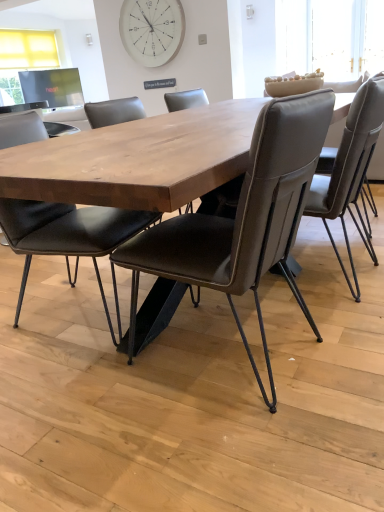
Measure the distance between brown leather chair at center, the 2th chair viewed from the left, and camera.

96.15 centimeters.

The width and height of the screenshot is (384, 512). What do you see at coordinates (152, 30) in the screenshot? I see `white wooden clock at upper center` at bounding box center [152, 30].

This screenshot has height=512, width=384. I want to click on leather-like chair at center, marked as the 1th chair in a right-to-left arrangement, so click(x=350, y=159).

Between matte black chair at center, which ranks as the 3th chair in right-to-left order, and brown leather chair at center, which is the second chair from right to left, which one appears on the left side from the viewer's perspective?

matte black chair at center, which ranks as the 3th chair in right-to-left order.

Is matte black chair at center, positioned as the 1th chair in left-to-right order, looking in the opposite direction of brown leather chair at center, which is the second chair from right to left?

That's not correct — matte black chair at center, positioned as the 1th chair in left-to-right order, is not looking away from brown leather chair at center, which is the second chair from right to left.

Is matte black chair at center, positioned as the 1th chair in left-to-right order, closer to the viewer compared to brown leather chair at center, the 2th chair viewed from the left?

No, the depth of matte black chair at center, positioned as the 1th chair in left-to-right order, is greater than that of brown leather chair at center, the 2th chair viewed from the left.

In terms of height, does matte black chair at center, positioned as the 1th chair in left-to-right order, look taller or shorter compared to brown leather chair at center, the 2th chair viewed from the left?

Considering their sizes, matte black chair at center, positioned as the 1th chair in left-to-right order, has more height than brown leather chair at center, the 2th chair viewed from the left.

Does point (306, 120) come behind point (170, 28)?

No.

From a real-world perspective, between brown leather chair at center, the 2th chair viewed from the left, and white wooden clock at upper center, who is vertically higher?

white wooden clock at upper center, from a real-world perspective.

Is brown leather chair at center, which is the second chair from right to left, not close to white wooden clock at upper center?

Yes.

Does brown leather chair at center, which is the second chair from right to left, appear on the right side of white wooden clock at upper center?

Correct, you'll find brown leather chair at center, which is the second chair from right to left, to the right of white wooden clock at upper center.

Considering the points (281, 241) and (374, 115), which point is in front, point (281, 241) or point (374, 115)?

The point (281, 241) is closer to the camera.

Is brown leather chair at center, the 2th chair viewed from the left, facing away from leather-like chair at center, marked as the 1th chair in a right-to-left arrangement?

No, leather-like chair at center, marked as the 1th chair in a right-to-left arrangement, is not at the back of brown leather chair at center, the 2th chair viewed from the left.

From the image's perspective, is brown leather chair at center, the 2th chair viewed from the left, below leather-like chair at center, marked as the 1th chair in a right-to-left arrangement?

Yes, from the image's perspective, brown leather chair at center, the 2th chair viewed from the left, is below leather-like chair at center, marked as the 1th chair in a right-to-left arrangement.

From a real-world perspective, is brown leather chair at center, which is the second chair from right to left, below leather-like chair at center, the third chair positioned from the left?

Yes, from a real-world perspective, brown leather chair at center, which is the second chair from right to left, is beneath leather-like chair at center, the third chair positioned from the left.

From a real-world perspective, which is physically below, white wooden clock at upper center or leather-like chair at center, the third chair positioned from the left?

leather-like chair at center, the third chair positioned from the left.

Which object is further away from the camera, white wooden clock at upper center or leather-like chair at center, marked as the 1th chair in a right-to-left arrangement?

white wooden clock at upper center.

Is white wooden clock at upper center positioned with its back to leather-like chair at center, the third chair positioned from the left?

No, leather-like chair at center, the third chair positioned from the left, is not at the back of white wooden clock at upper center.

Is white wooden clock at upper center wider than leather-like chair at center, marked as the 1th chair in a right-to-left arrangement?

In fact, white wooden clock at upper center might be narrower than leather-like chair at center, marked as the 1th chair in a right-to-left arrangement.

From the image's perspective, is leather-like chair at center, marked as the 1th chair in a right-to-left arrangement, positioned above or below white wooden clock at upper center?

Clearly, from the image's perspective, leather-like chair at center, marked as the 1th chair in a right-to-left arrangement, is below white wooden clock at upper center.

Would you consider leather-like chair at center, marked as the 1th chair in a right-to-left arrangement, to be distant from white wooden clock at upper center?

leather-like chair at center, marked as the 1th chair in a right-to-left arrangement, is far away from white wooden clock at upper center.

Visually, is leather-like chair at center, marked as the 1th chair in a right-to-left arrangement, positioned to the left or to the right of white wooden clock at upper center?

leather-like chair at center, marked as the 1th chair in a right-to-left arrangement, is positioned on white wooden clock at upper center's right side.

Looking at this image, does leather-like chair at center, marked as the 1th chair in a right-to-left arrangement, have a greater width compared to white wooden clock at upper center?

Yes, leather-like chair at center, marked as the 1th chair in a right-to-left arrangement, is wider than white wooden clock at upper center.

Would you say matte black chair at center, positioned as the 1th chair in left-to-right order, is part of white wooden clock at upper center's contents?

No, matte black chair at center, positioned as the 1th chair in left-to-right order, is not a part of white wooden clock at upper center.

Could you tell me if white wooden clock at upper center is turned towards matte black chair at center, which ranks as the 3th chair in right-to-left order?

Yes, white wooden clock at upper center is oriented towards matte black chair at center, which ranks as the 3th chair in right-to-left order.

Is white wooden clock at upper center not near matte black chair at center, which ranks as the 3th chair in right-to-left order?

Indeed, white wooden clock at upper center is not near matte black chair at center, which ranks as the 3th chair in right-to-left order.

Considering the points (315, 186) and (320, 95), which point is in front, point (315, 186) or point (320, 95)?

The point (320, 95) is closer.

From the picture: Is leather-like chair at center, marked as the 1th chair in a right-to-left arrangement, situated inside brown leather chair at center, the 2th chair viewed from the left, or outside?

The correct answer is: outside.

In terms of width, does leather-like chair at center, the third chair positioned from the left, look wider or thinner when compared to brown leather chair at center, which is the second chair from right to left?

leather-like chair at center, the third chair positioned from the left, is thinner than brown leather chair at center, which is the second chair from right to left.

Is leather-like chair at center, marked as the 1th chair in a right-to-left arrangement, directly adjacent to brown leather chair at center, the 2th chair viewed from the left?

leather-like chair at center, marked as the 1th chair in a right-to-left arrangement, is not next to brown leather chair at center, the 2th chair viewed from the left, and they're not touching.

At what (x,y) coordinates should I click in order to perform the action: click on the 1st chair above the brown leather chair at center, which is the second chair from right to left (from the image's perspective). Please return your answer as a coordinate pair (x, y). This screenshot has height=512, width=384. Looking at the image, I should click on (68, 234).

What are the coordinates of `clock above the brown leather chair at center, which is the second chair from right to left (from a real-world perspective)` in the screenshot? It's located at (152, 30).

Based on their spatial positions, is matte black chair at center, which ranks as the 3th chair in right-to-left order, or brown leather chair at center, which is the second chair from right to left, further from leather-like chair at center, the third chair positioned from the left?

matte black chair at center, which ranks as the 3th chair in right-to-left order, is positioned further to the anchor leather-like chair at center, the third chair positioned from the left.

Which object lies further to the anchor point white wooden clock at upper center, brown leather chair at center, the 2th chair viewed from the left, or leather-like chair at center, the third chair positioned from the left?

brown leather chair at center, the 2th chair viewed from the left, is further to white wooden clock at upper center.

Based on their spatial positions, is brown leather chair at center, the 2th chair viewed from the left, or leather-like chair at center, marked as the 1th chair in a right-to-left arrangement, further from matte black chair at center, positioned as the 1th chair in left-to-right order?

Among the two, leather-like chair at center, marked as the 1th chair in a right-to-left arrangement, is located further to matte black chair at center, positioned as the 1th chair in left-to-right order.

Based on their spatial positions, is white wooden clock at upper center or leather-like chair at center, the third chair positioned from the left, further from matte black chair at center, positioned as the 1th chair in left-to-right order?

white wooden clock at upper center is further to matte black chair at center, positioned as the 1th chair in left-to-right order.

Estimate the real-world distances between objects in this image. Which object is further from matte black chair at center, positioned as the 1th chair in left-to-right order, brown leather chair at center, which is the second chair from right to left, or white wooden clock at upper center?

white wooden clock at upper center is further to matte black chair at center, positioned as the 1th chair in left-to-right order.

Looking at the image, which one is located further to white wooden clock at upper center, leather-like chair at center, the third chair positioned from the left, or matte black chair at center, positioned as the 1th chair in left-to-right order?

Based on the image, matte black chair at center, positioned as the 1th chair in left-to-right order, appears to be further to white wooden clock at upper center.

Based on their spatial positions, is white wooden clock at upper center or matte black chair at center, positioned as the 1th chair in left-to-right order, further from leather-like chair at center, the third chair positioned from the left?

white wooden clock at upper center is further to leather-like chair at center, the third chair positioned from the left.

When comparing their distances from brown leather chair at center, the 2th chair viewed from the left, does white wooden clock at upper center or matte black chair at center, positioned as the 1th chair in left-to-right order, seem further?

white wooden clock at upper center is further to brown leather chair at center, the 2th chair viewed from the left.

Locate an element on the screen. chair between matte black chair at center, positioned as the 1th chair in left-to-right order, and leather-like chair at center, marked as the 1th chair in a right-to-left arrangement, from left to right is located at coordinates (242, 221).

Where is `chair between matte black chair at center, which ranks as the 3th chair in right-to-left order, and white wooden clock at upper center, along the z-axis`? Image resolution: width=384 pixels, height=512 pixels. chair between matte black chair at center, which ranks as the 3th chair in right-to-left order, and white wooden clock at upper center, along the z-axis is located at coordinates (350, 159).